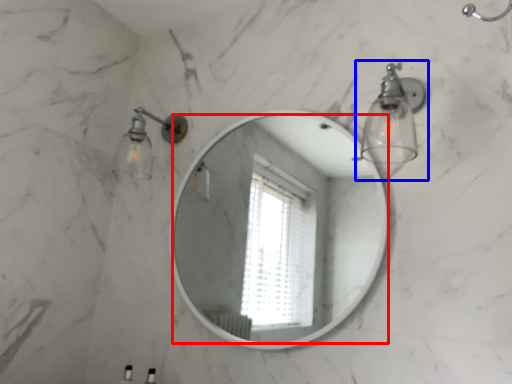
Question: Which object is closer to the camera taking this photo, mirror (highlighted by a red box) or light fixture (highlighted by a blue box)?

Choices:
 (A) mirror
 (B) light fixture

Answer: (B)